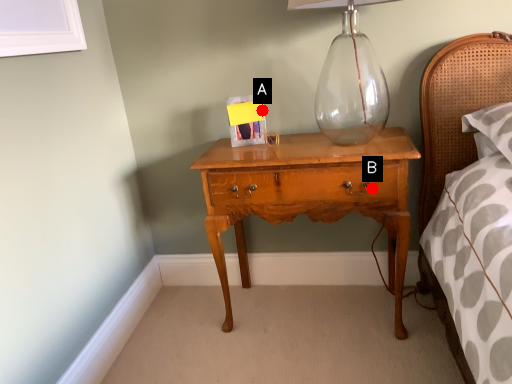
Question: Two points are circled on the image, labeled by A and B beside each circle. Which point is further to the camera?

Choices:
 (A) A is further
 (B) B is further

Answer: (A)